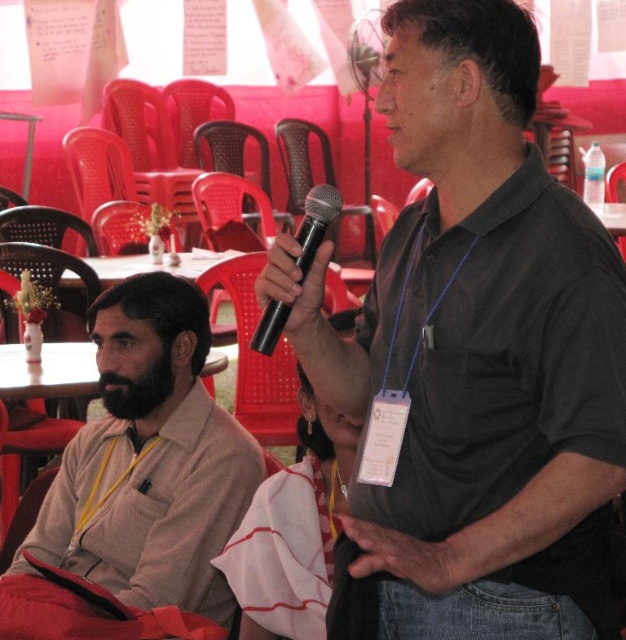
Does black matte shirt at center have a greater height compared to beige sweater at left?

Yes.

Between point (612, 451) and point (145, 584), which one is positioned behind?

Point (145, 584)

Describe the element at coordinates (475, 356) in the screenshot. Image resolution: width=626 pixels, height=640 pixels. I see `black matte shirt at center` at that location.

At what (x,y) coordinates should I click in order to perform the action: click on black matte shirt at center. Please return your answer as a coordinate pair (x, y). The image size is (626, 640). Looking at the image, I should click on (475, 356).

Is beige sweater at left shorter than black matte microphone at center?

Incorrect, beige sweater at left's height does not fall short of black matte microphone at center's.

Does beige sweater at left have a greater height compared to black matte microphone at center?

Yes, beige sweater at left is taller than black matte microphone at center.

From the picture: Who is more forward, (130, 532) or (300, 237)?

Point (300, 237) is more forward.

What are the coordinates of `beige sweater at left` in the screenshot? It's located at tap(150, 460).

Which of these two, black matte shirt at center or black matte microphone at center, stands taller?

black matte shirt at center is taller.

Consider the image. Between black matte shirt at center and black matte microphone at center, which one has less height?

black matte microphone at center is shorter.

Is point (485, 40) less distant than point (269, 353)?

That is True.

Locate an element on the screen. The height and width of the screenshot is (640, 626). black matte shirt at center is located at coordinates (475, 356).